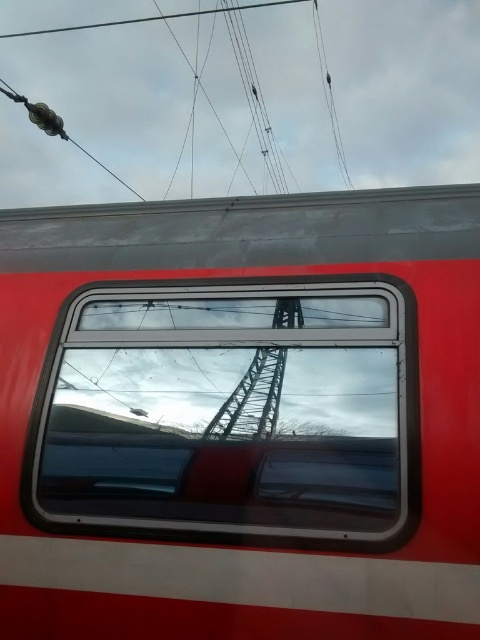
You are a maintenance worker checking the train. You notice the metallic red train window at center and the metallic wire at upper center. Which object is positioned higher from the ground?

The metallic wire at upper center is positioned higher from the ground than the metallic red train window at center.

You are a maintenance worker on the train and need to inspect two points on the train body. The first point is at coordinates point (380, 221) and the second is at point (227, 458). Which point is closer to the front of the train?

Point (227, 458) is closer to the front of the train because it is in front of point (380, 221).

You are a maintenance worker checking the train exterior. You need to determine if the metallic red train window at center is taller than the metallic wire at upper center. Based on the scene, what can you conclude?

The metallic red train window at center has a greater height compared to the metallic wire at upper center, so the window is taller than the wire.